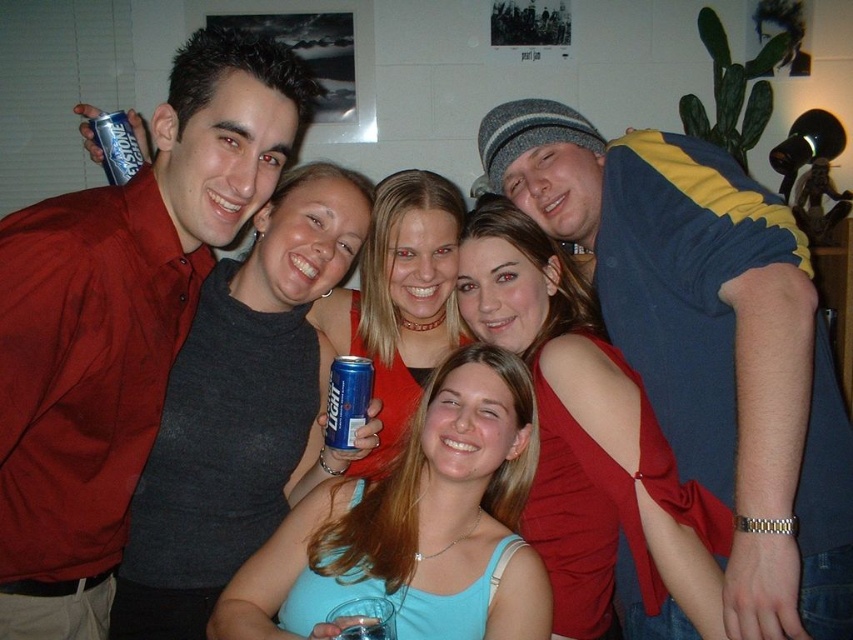
You are standing in a room and see the matte red dress at center. If you want to reach it in 3 steps, will you be able to? Assume each of your steps is 2 feet long.

The distance between you and the matte red dress at center is 5.18 feet. If each step is 2 feet, then 3 steps would cover 6 feet. Since 6 feet is greater than 5.18 feet, you can reach it in 3 steps.

You are at a party and want to hand a drink to the person wearing the blue and yellow striped shirt at upper right. Since you are of average height, will you need to reach up or down to give them the drink compared to handing it to the matte red shirt at left?

The blue and yellow striped shirt at upper right is much taller than the matte red shirt at left, so you would need to reach up more to hand the drink to the blue and yellow striped shirt at upper right compared to the matte red shirt at left.